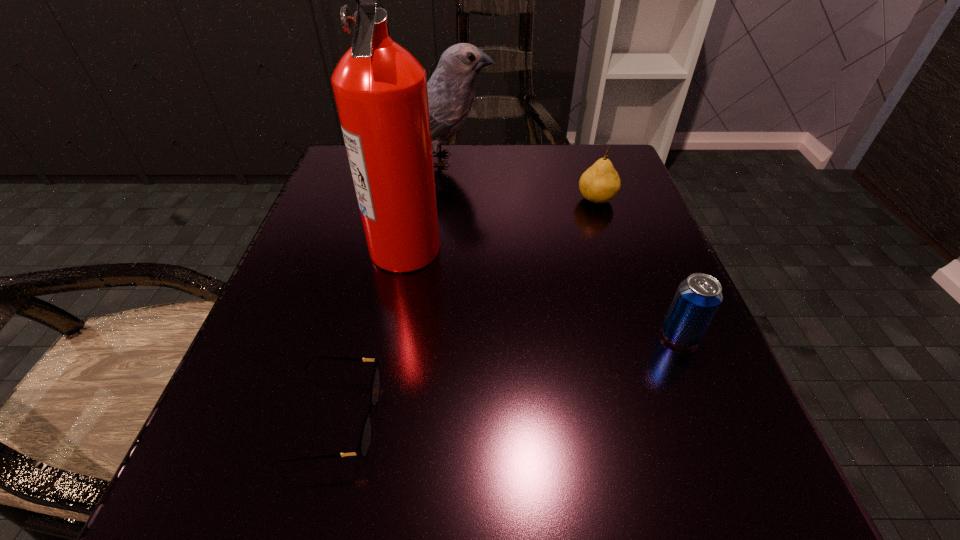
Image resolution: width=960 pixels, height=540 pixels. I want to click on empty space that is in between the shortest object and the pear, so click(x=465, y=309).

You are a GUI agent. You are given a task and a screenshot of the screen. Output one action in this format:
    pyautogui.click(x=<x>, y=<y>)
    Task: Click on the vacant area that lies between the fourth nearest object and the beer can
    
    Given the screenshot: What is the action you would take?
    pyautogui.click(x=638, y=267)

This screenshot has height=540, width=960. In order to click on blank region between the fourth shortest object and the shortest object in this screenshot , I will do `click(390, 289)`.

Find the location of a particular element. vacant area between the nearest object and the parrot is located at coordinates (390, 289).

You are a GUI agent. You are given a task and a screenshot of the screen. Output one action in this format:
    pyautogui.click(x=<x>, y=<y>)
    Task: Click on the vacant space in between the pear and the farthest object
    This screenshot has height=540, width=960.
    Given the screenshot: What is the action you would take?
    pyautogui.click(x=521, y=180)

At what (x,y) coordinates should I click in order to perform the action: click on unoccupied position between the farthest object and the beer can. Please return your answer as a coordinate pair (x, y). Looking at the image, I should click on (563, 247).

The image size is (960, 540). What are the coordinates of `vacant area between the parrot and the fourth nearest object` in the screenshot? It's located at (521, 180).

The height and width of the screenshot is (540, 960). What are the coordinates of `free spot between the second farthest object and the fourth farthest object` in the screenshot? It's located at (638, 267).

Identify which object is located as the second nearest to the shortest object. Please provide its 2D coordinates. Your answer should be formatted as a tuple, i.e. [(x, y)], where the tuple contains the x and y coordinates of a point satisfying the conditions above.

[(698, 297)]

The image size is (960, 540). I want to click on the fourth closest object relative to the fire extinguisher, so click(698, 297).